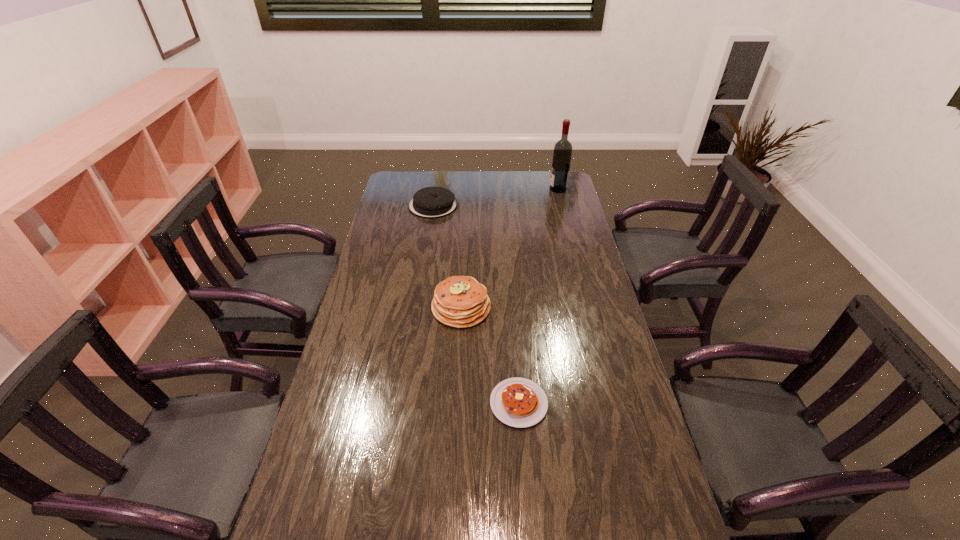
In the image, there is a desktop. Identify the location of free space at the far edge. (492, 187).

Find the location of `vacant space at the left edge`. vacant space at the left edge is located at coordinates [413, 235].

The image size is (960, 540). Find the location of `free space at the right edge of the desktop`. free space at the right edge of the desktop is located at coordinates [594, 341].

In the image, there is a desktop. Where is `vacant space at the far left corner`? This screenshot has width=960, height=540. vacant space at the far left corner is located at coordinates (400, 172).

You are a GUI agent. You are given a task and a screenshot of the screen. Output one action in this format:
    pyautogui.click(x=<x>, y=<y>)
    Task: Click on the free spot at the far right corner of the desktop
    The width and height of the screenshot is (960, 540).
    Given the screenshot: What is the action you would take?
    pyautogui.click(x=542, y=188)

Locate an element on the screen. The height and width of the screenshot is (540, 960). vacant area that lies between the tallest pancake and the farthest pancake is located at coordinates (447, 256).

This screenshot has width=960, height=540. What are the coordinates of `vacant point located between the alcohol and the shortest pancake` in the screenshot? It's located at (539, 296).

Where is `free spot between the shortest pancake and the rightmost object`? The height and width of the screenshot is (540, 960). free spot between the shortest pancake and the rightmost object is located at coordinates (539, 296).

What are the coordinates of `empty space that is in between the alcohol and the shortest object` in the screenshot? It's located at (539, 296).

Locate an element on the screen. This screenshot has height=540, width=960. free spot between the farthest pancake and the alcohol is located at coordinates (495, 198).